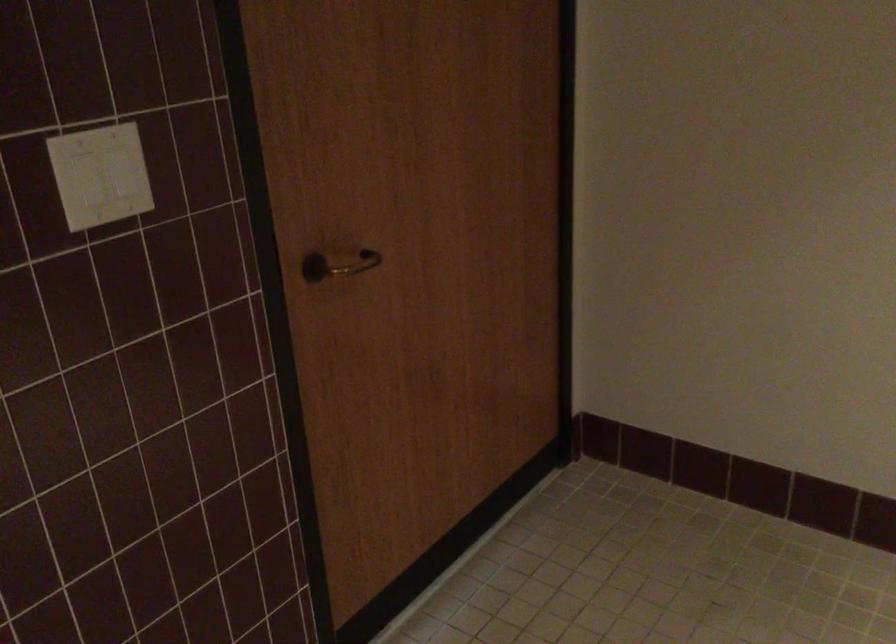
Where is `light switch`? Image resolution: width=896 pixels, height=644 pixels. light switch is located at coordinates (101, 175).